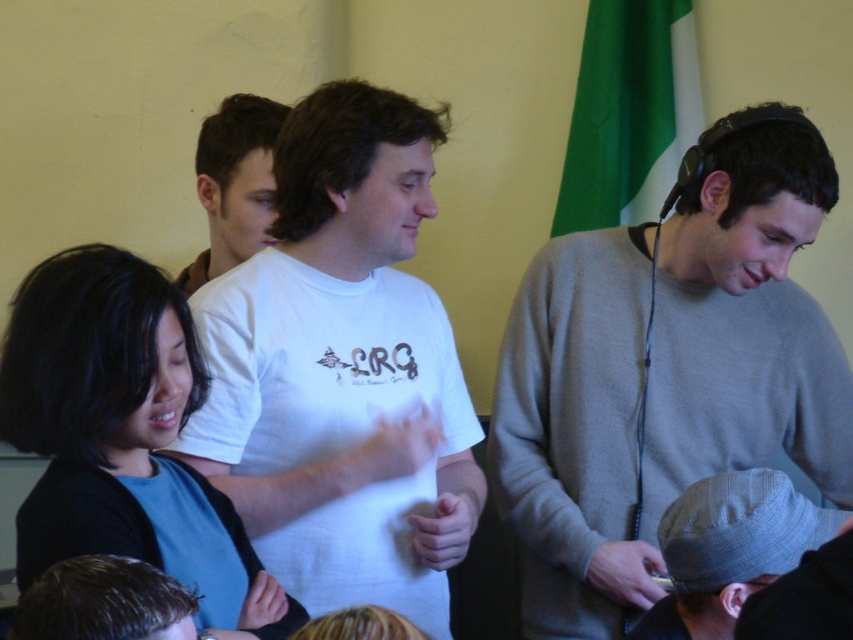
Question: Based on their relative distances, which object is nearer to the white cotton t-shirt at center?

Choices:
 (A) gray sweater at center
 (B) gray fabric cap at lower right
 (C) white t-shirt at center
 (D) black matte hair at center

Answer: (D)

Question: Where is gray fabric cap at lower right located in relation to white t-shirt at center in the image?

Choices:
 (A) left
 (B) right

Answer: (B)

Question: Which is nearer to the white cotton t-shirt at center?

Choices:
 (A) white t-shirt at center
 (B) black matte hair at center
 (C) gray sweater at center

Answer: (B)

Question: Is gray fabric cap at lower right above white t-shirt at center?

Choices:
 (A) yes
 (B) no

Answer: (B)

Question: Can you confirm if black matte hair at center is bigger than gray fabric cap at lower right?

Choices:
 (A) no
 (B) yes

Answer: (B)

Question: Estimate the real-world distances between objects in this image. Which object is farther from the black matte hair at center?

Choices:
 (A) gray sweater at center
 (B) gray fabric cap at lower right
 (C) white cotton t-shirt at center

Answer: (A)